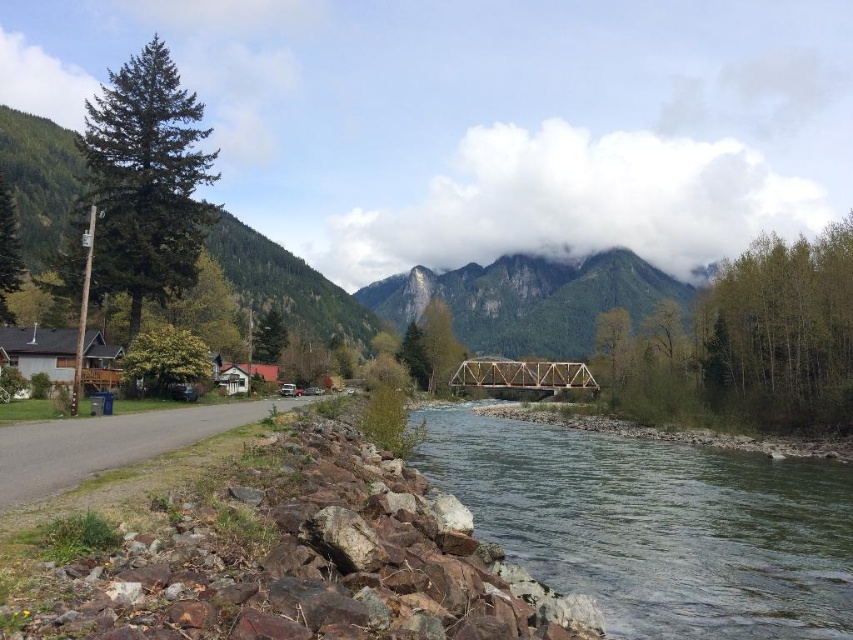
Question: Which point is closer to the camera?

Choices:
 (A) (28, 230)
 (B) (660, 285)
 (C) (239, 492)

Answer: (C)

Question: Does rugged stone mountain at center appear on the right side of green coniferous tree at left?

Choices:
 (A) yes
 (B) no

Answer: (A)

Question: Is brown rock wall at lower left thinner than rugged stone mountain at center?

Choices:
 (A) yes
 (B) no

Answer: (A)

Question: Which point appears closest to the camera in this image?

Choices:
 (A) (434, 577)
 (B) (543, 291)

Answer: (A)

Question: Which of these objects is positioned closest to the rugged stone mountain at center?

Choices:
 (A) green coniferous tree at left
 (B) brown rock wall at lower left

Answer: (A)

Question: Considering the relative positions of brown rock wall at lower left and clear water at center in the image provided, where is brown rock wall at lower left located with respect to clear water at center?

Choices:
 (A) below
 (B) above

Answer: (B)